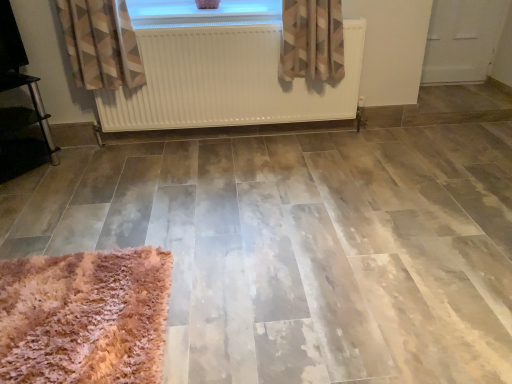
Question: In terms of size, does transparent glass window at upper center appear bigger or smaller than fuzzy pink rug at lower left?

Choices:
 (A) small
 (B) big

Answer: (A)

Question: Is transparent glass window at upper center taller or shorter than fuzzy pink rug at lower left?

Choices:
 (A) tall
 (B) short

Answer: (B)

Question: Estimate the real-world distances between objects in this image. Which object is farther from the fuzzy pink rug at lower left?

Choices:
 (A) white matte radiator at upper center
 (B) transparent glass window at upper center

Answer: (B)

Question: Based on their relative distances, which object is farther from the white matte radiator at upper center?

Choices:
 (A) transparent glass window at upper center
 (B) fuzzy pink rug at lower left

Answer: (B)